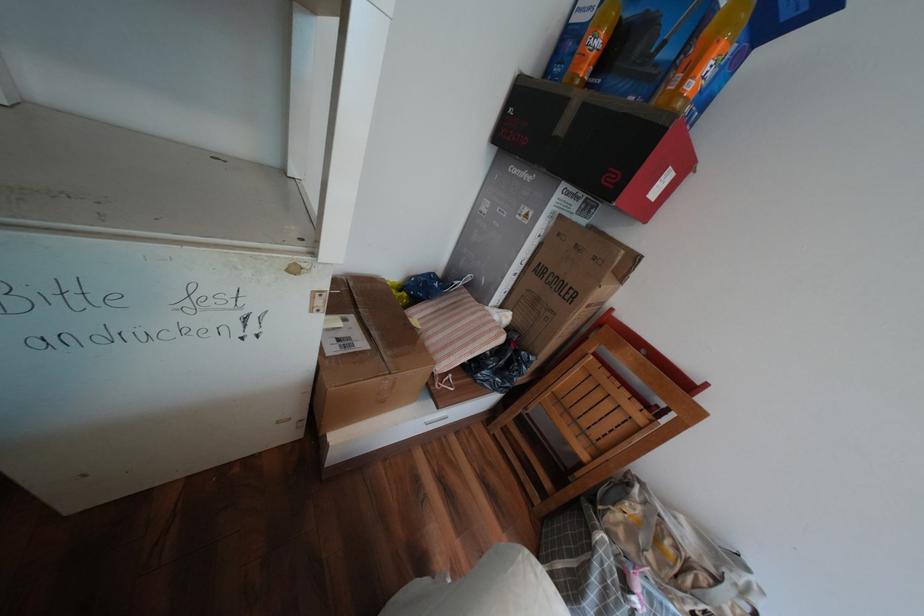
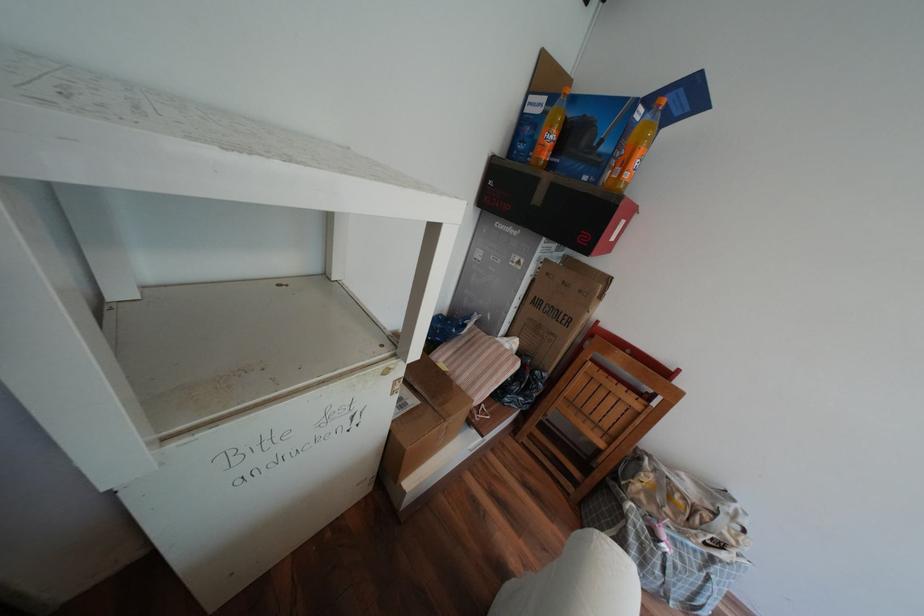
In the second image, find the point that corresponds to (x=500, y=330) in the first image.

(517, 360)